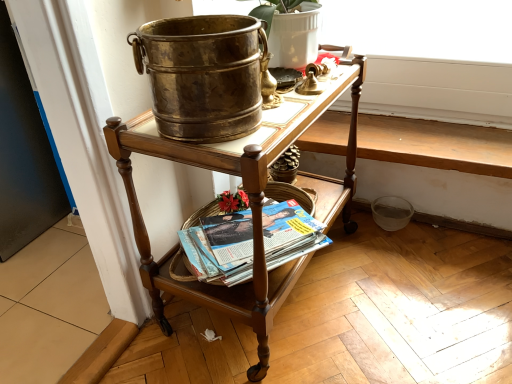
Measure the distance between point [205,305] and camera.

The depth of point [205,305] is 3.44 feet.

Image resolution: width=512 pixels, height=384 pixels. Describe the element at coordinates (291, 232) in the screenshot. I see `matte paperbacks at lower center` at that location.

Describe the element at coordinates (203, 75) in the screenshot. I see `matte white flowerpot at upper center` at that location.

You are a GUI agent. You are given a task and a screenshot of the screen. Output one action in this format:
    pyautogui.click(x=<x>, y=<y>)
    Task: Click on the polished wood desk at center
    Image resolution: width=512 pixels, height=384 pixels.
    Given the screenshot: What is the action you would take?
    pyautogui.click(x=250, y=205)

Is point (167, 50) closer to camera compared to point (261, 327)?

Yes, point (167, 50) is closer to viewer.

Is matte white flowerpot at upper center inside the boundaries of polished wood desk at center, or outside?

matte white flowerpot at upper center is not enclosed by polished wood desk at center.

Does matte white flowerpot at upper center touch polished wood desk at center?

No, matte white flowerpot at upper center is not making contact with polished wood desk at center.

In the image, is matte paperbacks at lower center positioned in front of or behind polished wood desk at center?

In the image, matte paperbacks at lower center appears behind polished wood desk at center.

From a real-world perspective, is matte paperbacks at lower center located higher than polished wood desk at center?

No.

Is point (244, 265) farther from viewer compared to point (309, 109)?

Yes, point (244, 265) is farther from viewer.

In terms of height, does polished wood desk at center look taller or shorter compared to matte white flowerpot at upper center?

Clearly, polished wood desk at center is taller compared to matte white flowerpot at upper center.

From the image's perspective, does polished wood desk at center appear lower than matte white flowerpot at upper center?

Indeed, from the image's perspective, polished wood desk at center is shown beneath matte white flowerpot at upper center.

Is point (242, 144) positioned before point (178, 41)?

No, (242, 144) is further to viewer.

Does matte white flowerpot at upper center lie in front of matte paperbacks at lower center?

Yes, matte white flowerpot at upper center is closer to the camera.

From a real-world perspective, who is located lower, matte white flowerpot at upper center or matte paperbacks at lower center?

matte paperbacks at lower center is physically lower.

In terms of width, does matte white flowerpot at upper center look wider or thinner when compared to matte paperbacks at lower center?

Considering their sizes, matte white flowerpot at upper center looks slimmer than matte paperbacks at lower center.

Is point (194, 61) closer to camera compared to point (241, 282)?

Yes, it is.

Is matte paperbacks at lower center surrounded by polished wood desk at center?

Yes, matte paperbacks at lower center is inside polished wood desk at center.

From a real-world perspective, does polished wood desk at center stand above matte paperbacks at lower center?

Indeed, from a real-world perspective, polished wood desk at center stands above matte paperbacks at lower center.

From the image's perspective, is polished wood desk at center on matte paperbacks at lower center?

Indeed, from the image's perspective, polished wood desk at center is shown above matte paperbacks at lower center.

What's the angular difference between polished wood desk at center and matte paperbacks at lower center's facing directions?

The facing directions of polished wood desk at center and matte paperbacks at lower center are 35.5 degrees apart.

At what (x,y) coordinates should I click in order to perform the action: click on paperback book on the right of the matte white flowerpot at upper center. Please return your answer as a coordinate pair (x, y). The width and height of the screenshot is (512, 384). Looking at the image, I should click on (291, 232).

Does matte paperbacks at lower center lie in front of matte white flowerpot at upper center?

No.

Considering the positions of objects matte paperbacks at lower center and matte white flowerpot at upper center in the image provided, who is more to the right, matte paperbacks at lower center or matte white flowerpot at upper center?

Positioned to the right is matte paperbacks at lower center.

The height and width of the screenshot is (384, 512). Find the location of `flowerpot above the polished wood desk at center (from a real-world perspective)`. flowerpot above the polished wood desk at center (from a real-world perspective) is located at coordinates (203, 75).

Image resolution: width=512 pixels, height=384 pixels. Identify the location of paperback book below the polished wood desk at center (from the image's perspective). (291, 232).

When comparing their distances from matte white flowerpot at upper center, does polished wood desk at center or matte paperbacks at lower center seem closer?

polished wood desk at center is closer to matte white flowerpot at upper center.

Looking at the image, which one is located further to polished wood desk at center, matte white flowerpot at upper center or matte paperbacks at lower center?

matte white flowerpot at upper center is positioned further to the anchor polished wood desk at center.

Estimate the real-world distances between objects in this image. Which object is further from polished wood desk at center, matte paperbacks at lower center or matte white flowerpot at upper center?

matte white flowerpot at upper center is positioned further to the anchor polished wood desk at center.

Estimate the real-world distances between objects in this image. Which object is closer to matte paperbacks at lower center, polished wood desk at center or matte white flowerpot at upper center?

Among the two, polished wood desk at center is located nearer to matte paperbacks at lower center.

Estimate the real-world distances between objects in this image. Which object is closer to matte white flowerpot at upper center, matte paperbacks at lower center or polished wood desk at center?

polished wood desk at center is positioned closer to the anchor matte white flowerpot at upper center.

When comparing their distances from matte paperbacks at lower center, does matte white flowerpot at upper center or polished wood desk at center seem further?

Based on the image, matte white flowerpot at upper center appears to be further to matte paperbacks at lower center.

Where is `desk that lies between matte white flowerpot at upper center and matte paperbacks at lower center from top to bottom`? The width and height of the screenshot is (512, 384). desk that lies between matte white flowerpot at upper center and matte paperbacks at lower center from top to bottom is located at coordinates (250, 205).